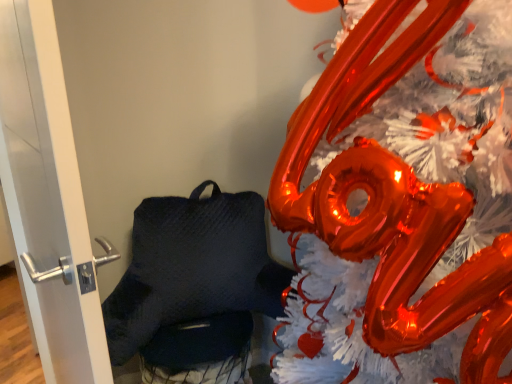
Question: Is shiny metallic balloon at upper right to the right of white glossy door handle at left from the viewer's perspective?

Choices:
 (A) no
 (B) yes

Answer: (B)

Question: Considering the relative positions of shiny metallic balloon at upper right and white glossy door handle at left in the image provided, is shiny metallic balloon at upper right in front of white glossy door handle at left?

Choices:
 (A) yes
 (B) no

Answer: (A)

Question: From a real-world perspective, does shiny metallic balloon at upper right sit lower than white glossy door handle at left?

Choices:
 (A) yes
 (B) no

Answer: (A)

Question: Can we say shiny metallic balloon at upper right lies outside white glossy door handle at left?

Choices:
 (A) yes
 (B) no

Answer: (A)

Question: Is shiny metallic balloon at upper right in contact with white glossy door handle at left?

Choices:
 (A) yes
 (B) no

Answer: (B)

Question: Is white glossy door handle at left located within shiny metallic balloon at upper right?

Choices:
 (A) no
 (B) yes

Answer: (A)

Question: From a real-world perspective, is white glossy door handle at left positioned under shiny metallic balloon at upper right based on gravity?

Choices:
 (A) no
 (B) yes

Answer: (A)

Question: Can you confirm if white glossy door handle at left is wider than shiny metallic balloon at upper right?

Choices:
 (A) no
 (B) yes

Answer: (A)

Question: Does white glossy door handle at left have a lesser width compared to shiny metallic balloon at upper right?

Choices:
 (A) no
 (B) yes

Answer: (B)

Question: Can you confirm if white glossy door handle at left is bigger than shiny metallic balloon at upper right?

Choices:
 (A) no
 (B) yes

Answer: (A)

Question: Is white glossy door handle at left shorter than shiny metallic balloon at upper right?

Choices:
 (A) yes
 (B) no

Answer: (A)

Question: Are white glossy door handle at left and shiny metallic balloon at upper right located far from each other?

Choices:
 (A) yes
 (B) no

Answer: (B)

Question: Considering their positions, is white glossy door handle at left located in front of or behind shiny metallic balloon at upper right?

Choices:
 (A) behind
 (B) front

Answer: (A)